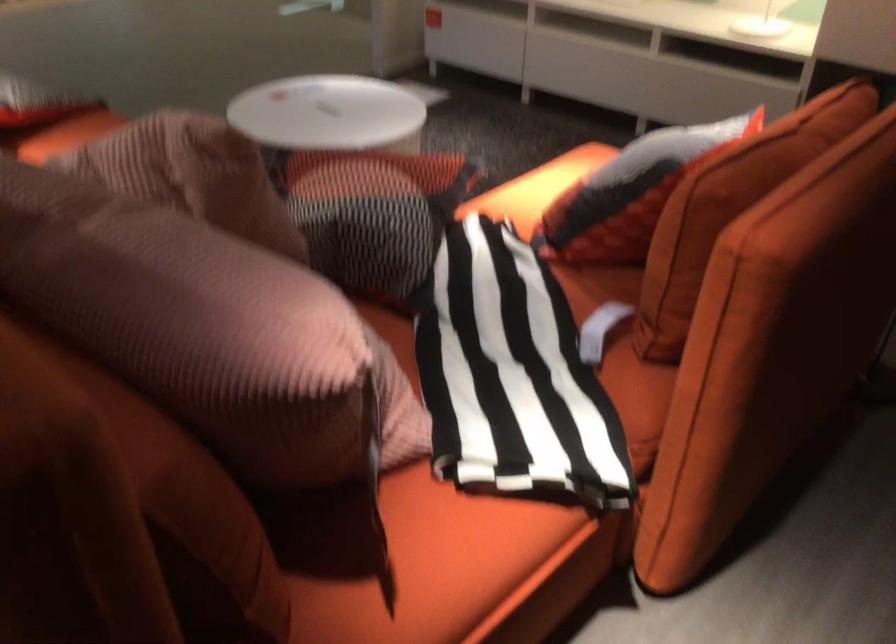
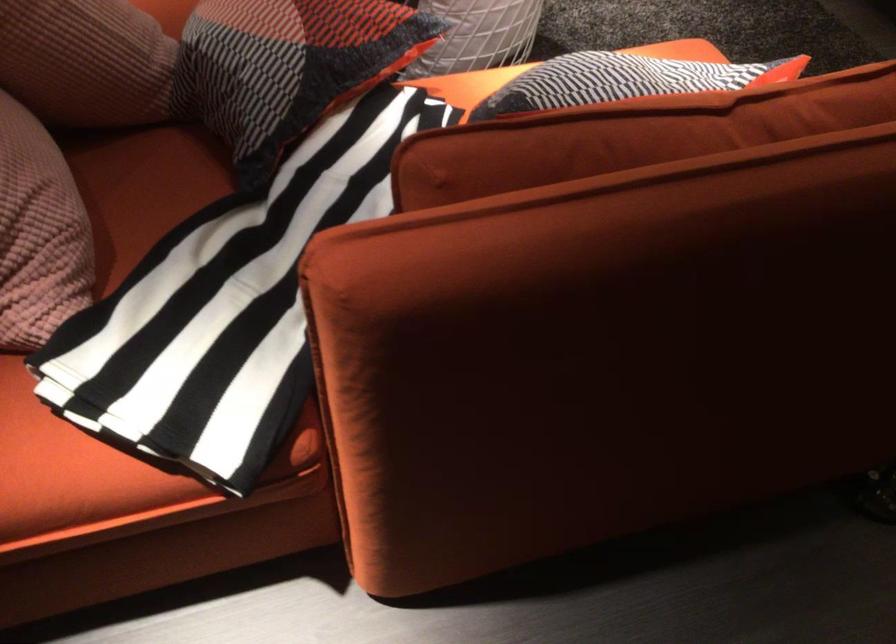
Locate, in the second image, the point that corresponds to [700,136] in the first image.

(623, 80)